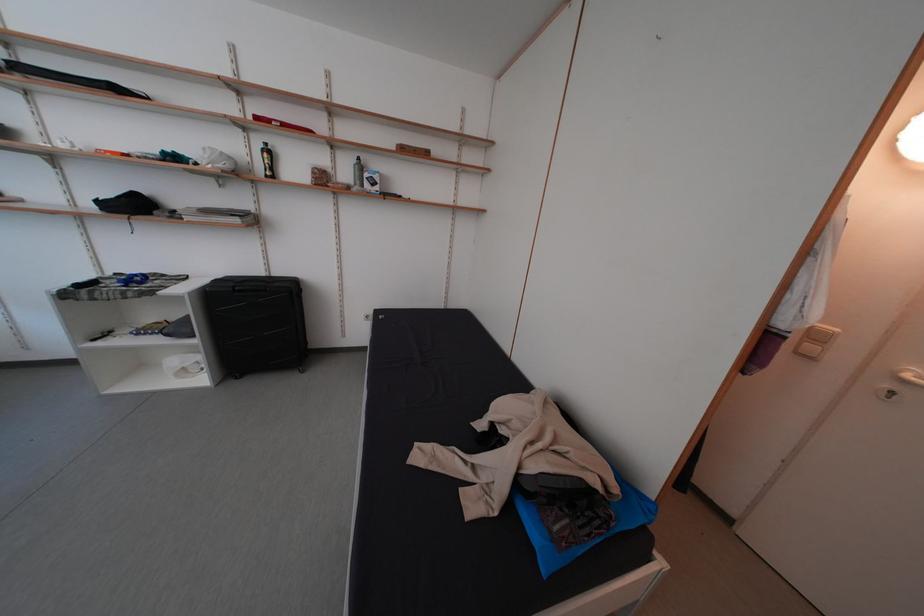
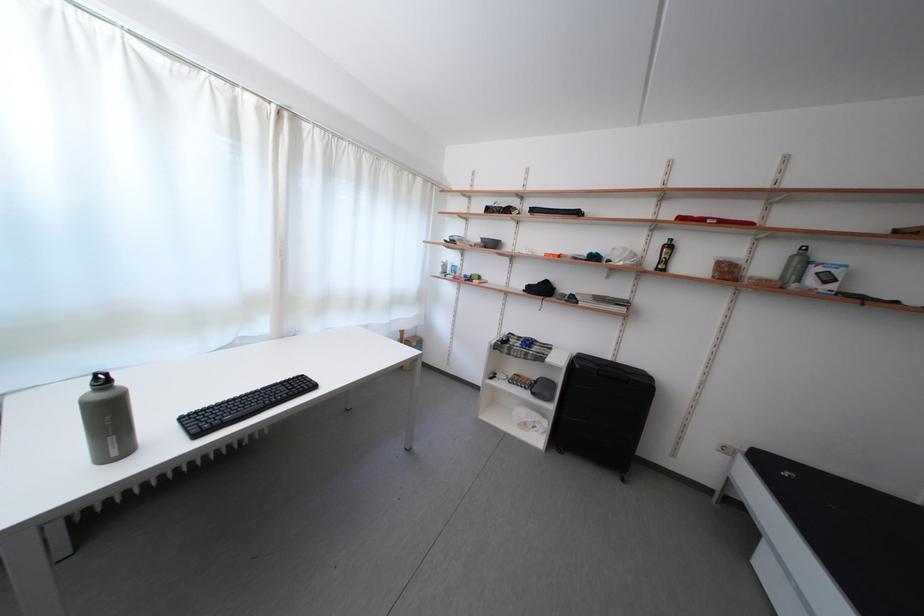
The point at (332,185) is marked in the first image. Where is the corresponding point in the second image?

(736, 278)